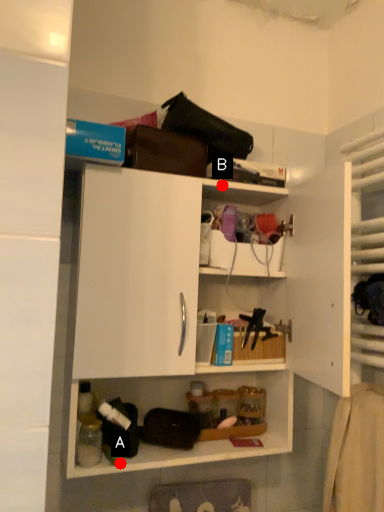
Question: Two points are circled on the image, labeled by A and B beside each circle. Which point is farther to the camera?

Choices:
 (A) A is further
 (B) B is further

Answer: (B)